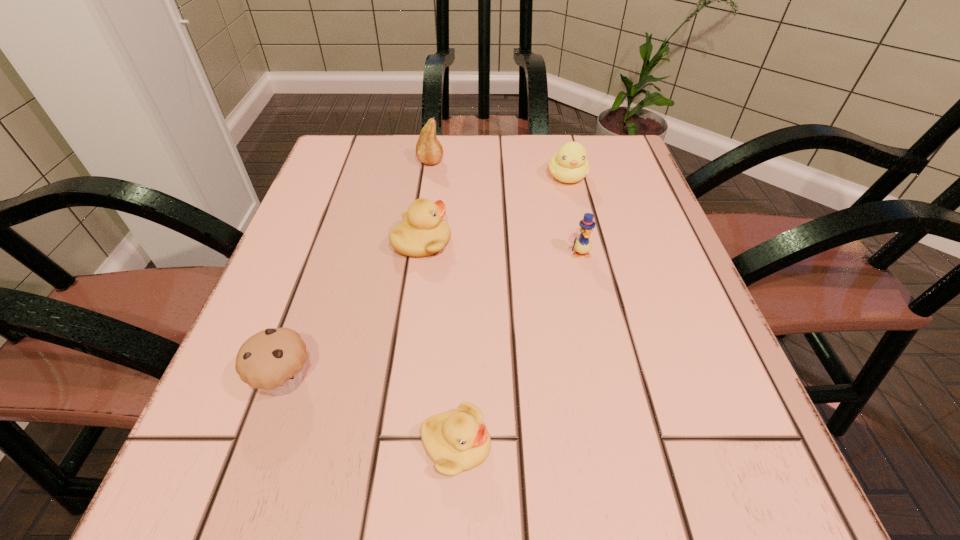
Locate an element on the screen. pear is located at coordinates (429, 150).

Image resolution: width=960 pixels, height=540 pixels. Find the location of `the farthest duckling`. the farthest duckling is located at coordinates (570, 164).

This screenshot has width=960, height=540. I want to click on the fifth farthest object, so click(273, 360).

Identify the location of muffin. The height and width of the screenshot is (540, 960). (273, 360).

Identify the location of the nearest duckling. This screenshot has width=960, height=540. (457, 440).

This screenshot has width=960, height=540. In order to click on the shortest object in this screenshot , I will do `click(457, 440)`.

What are the coordinates of `vacant space positioned on the left of the pear` in the screenshot? It's located at (324, 162).

The height and width of the screenshot is (540, 960). What are the coordinates of `free space located 0.090m at the beak of the farthest duckling` in the screenshot? It's located at (577, 217).

Locate an element on the screen. The height and width of the screenshot is (540, 960). blank space located on the right of the muffin is located at coordinates (561, 381).

I want to click on free region located at the face of the shortest duckling, so click(685, 445).